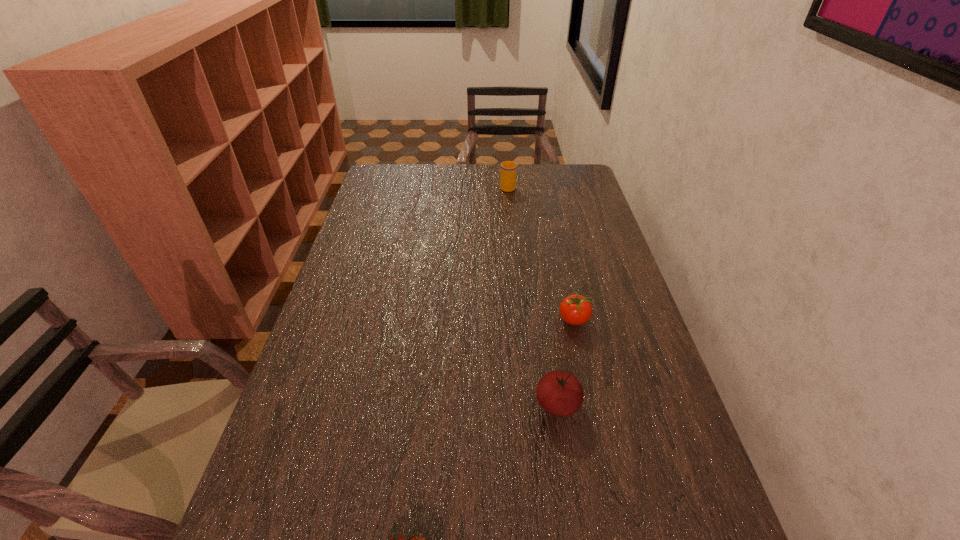
Find the location of `cup`. cup is located at coordinates (508, 168).

I want to click on the second farthest tomato, so click(560, 393).

This screenshot has width=960, height=540. In order to click on the tallest tomato in this screenshot , I will do `click(560, 393)`.

You are a GUI agent. You are given a task and a screenshot of the screen. Output one action in this format:
    pyautogui.click(x=<x>, y=<y>)
    Task: Click on the third nearest object
    
    Given the screenshot: What is the action you would take?
    pyautogui.click(x=575, y=309)

Locate an element on the screen. blank space located on the side of the cup with the handle is located at coordinates (506, 171).

Where is `vacant area located 0.210m on the back of the tallest tomato`? This screenshot has width=960, height=540. vacant area located 0.210m on the back of the tallest tomato is located at coordinates (545, 320).

What are the coordinates of `free location located 0.310m on the left of the second farthest object` in the screenshot? It's located at (444, 320).

You are a GUI agent. You are given a task and a screenshot of the screen. Output one action in this format:
    pyautogui.click(x=<x>, y=<y>)
    Task: Click on the object positioned at the far edge
    This screenshot has height=540, width=960.
    Given the screenshot: What is the action you would take?
    pyautogui.click(x=508, y=168)

Locate an element on the screen. object that is at the right edge is located at coordinates (575, 309).

At what (x,y) coordinates should I click in order to perform the action: click on free space at the far edge of the desktop. Please return your answer as a coordinate pair (x, y). Looking at the image, I should click on (445, 192).